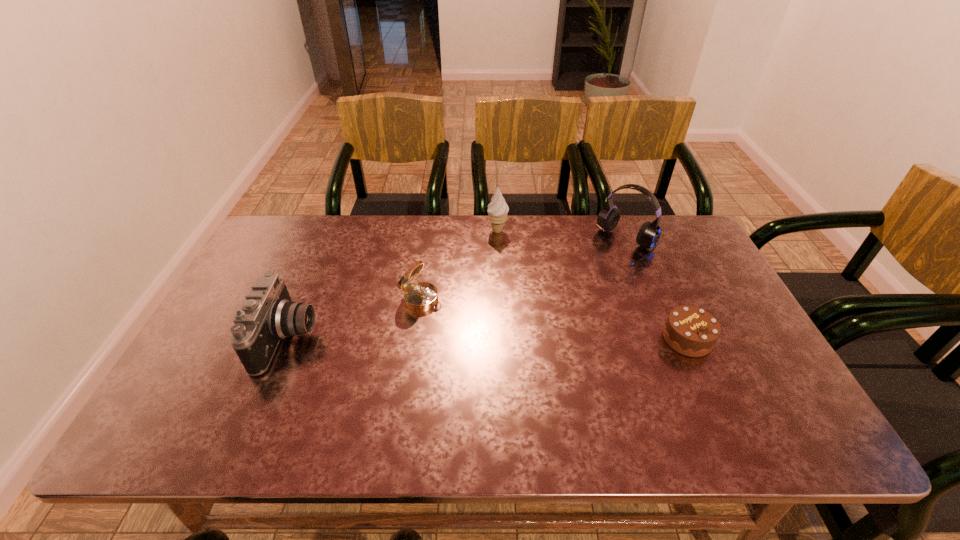
The width and height of the screenshot is (960, 540). I want to click on vacant spot on the desktop that is between the leftmost object and the chocolate cake and is positioned with the dial facing the compass, so click(501, 339).

This screenshot has width=960, height=540. I want to click on vacant space on the desktop that is between the leftmost object and the chocolate cake and is positioned on the front-facing side of the third object from right to left, so click(496, 339).

Where is `vacant space on the desktop that is between the camera and the chocolate cake and is positioned on the ear cushions of the headset`? vacant space on the desktop that is between the camera and the chocolate cake and is positioned on the ear cushions of the headset is located at coordinates (535, 339).